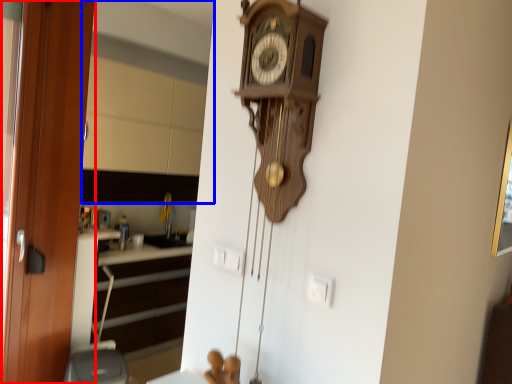
Question: Which object appears closest to the camera in this image, door (highlighted by a red box) or mirror (highlighted by a blue box)?

Choices:
 (A) door
 (B) mirror

Answer: (A)